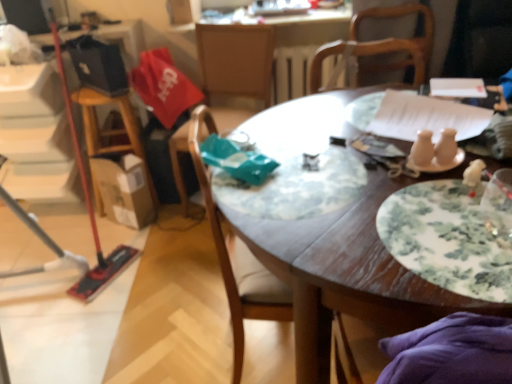
Question: Is point (236, 233) positioned closer to the camera than point (337, 92)?

Choices:
 (A) farther
 (B) closer

Answer: (B)

Question: Looking at their shapes, would you say wooden chair at center, marked as the 1th chair in a front-to-back arrangement, is wider or thinner than wooden table at center?

Choices:
 (A) wide
 (B) thin

Answer: (B)

Question: Estimate the real-world distances between objects in this image. Which object is farther from the wooden chair at center, the 2th chair when ordered from back to front?

Choices:
 (A) wooden table at center
 (B) floral-patterned ceramic plate at center-right
 (C) wooden chair at center, positioned as the first chair in back-to-front order

Answer: (C)

Question: Which of these objects is positioned closest to the wooden chair at center, the 2th chair when ordered from back to front?

Choices:
 (A) wooden chair at center, the second chair positioned from the front
 (B) wooden table at center
 (C) floral-patterned ceramic plate at center-right

Answer: (B)